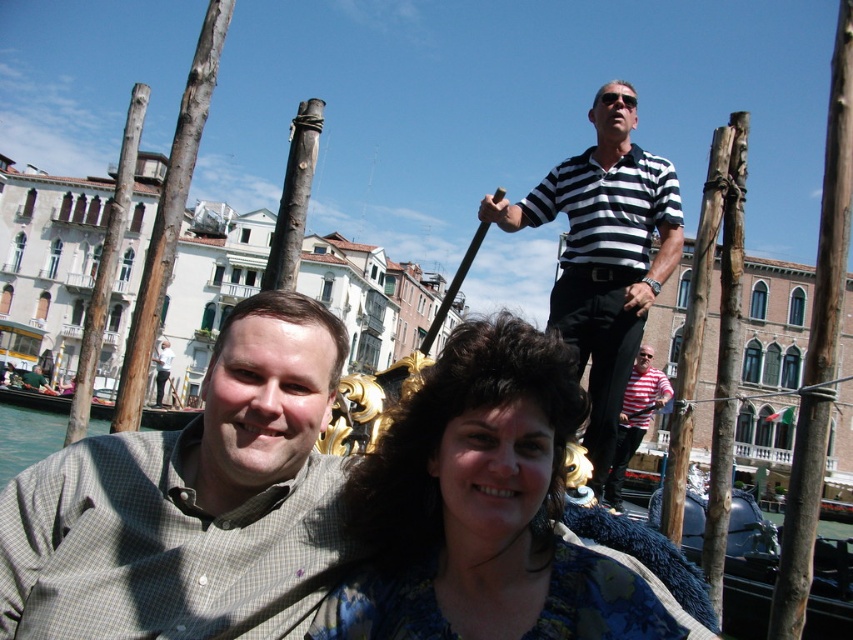
You are standing at the camera position and want to throw a small ball to the person wearing the gray checkered shirt at center. If the maximum throwing distance you can achieve is 25 meters, will you be able to reach them?

The distance between you and the gray checkered shirt at center is 26.54 meters, which exceeds your maximum throwing distance of 25 meters. Therefore, you will not be able to reach them with a single throw.

You are a photographer trying to capture a detailed shot of the blue floral blouse at center and the striped cotton shirt at upper center. Which one would you need to zoom in more on to ensure clarity?

The blue floral blouse at center occupies less space than the striped cotton shirt at upper center, so you would need to zoom in more on the blue floral blouse at center to ensure clarity.